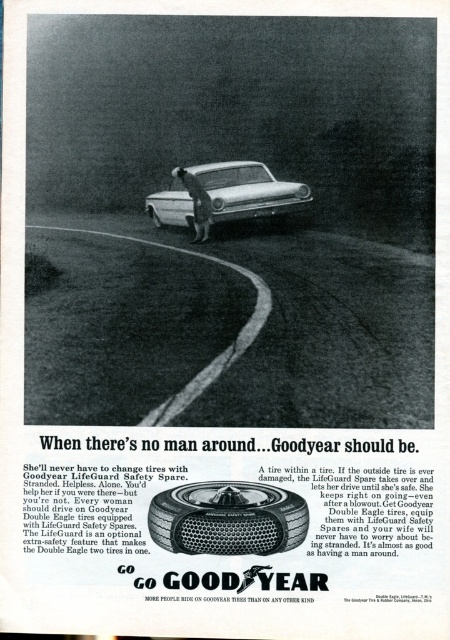
Between dirt track at center and matte rubber tire at center, which one has more height?

dirt track at center is taller.

Which is more to the right, dirt track at center or matte rubber tire at center?

dirt track at center is more to the right.

Is point (292, 388) positioned after point (158, 227)?

No, (292, 388) is closer to viewer.

Identify the location of dirt track at center. The width and height of the screenshot is (450, 640). click(225, 330).

In the scene shown: Who is more forward, (x=387, y=260) or (x=199, y=168)?

Point (x=387, y=260) is in front.

Is dirt track at center to the left of silver metallic sedan at center from the viewer's perspective?

Incorrect, dirt track at center is not on the left side of silver metallic sedan at center.

What do you see at coordinates (225, 330) in the screenshot? I see `dirt track at center` at bounding box center [225, 330].

You are a GUI agent. You are given a task and a screenshot of the screen. Output one action in this format:
    pyautogui.click(x=<x>, y=<y>)
    Task: Click on the dirt track at center
    
    Given the screenshot: What is the action you would take?
    pyautogui.click(x=225, y=330)

Is black rubber tire at center positioned before matte rubber tire at center?

Yes, black rubber tire at center is in front of matte rubber tire at center.

Does black rubber tire at center appear under matte rubber tire at center?

Correct, black rubber tire at center is located below matte rubber tire at center.

Where is `black rubber tire at center`? The height and width of the screenshot is (640, 450). black rubber tire at center is located at coordinates (228, 518).

Find the location of `black rubber tire at center`. black rubber tire at center is located at coordinates (228, 518).